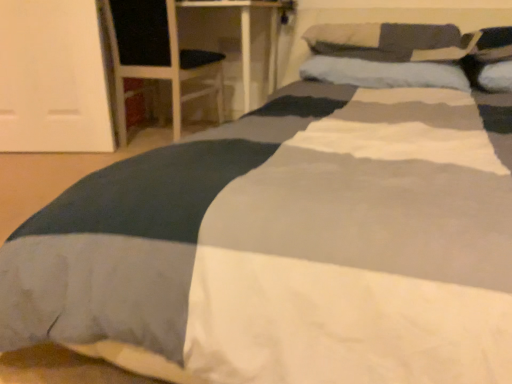
This screenshot has height=384, width=512. What do you see at coordinates (156, 55) in the screenshot?
I see `black fabric armchair at left` at bounding box center [156, 55].

Where is `soft blue pillow at center, which is counted as the second pillow, starting from the top`? soft blue pillow at center, which is counted as the second pillow, starting from the top is located at coordinates (384, 73).

Is point (169, 39) closer or farther from the camera than point (464, 41)?

Point (169, 39).

Which object is closer to the camera taking this photo, black fabric armchair at left or soft gray pillow at upper right, acting as the second pillow starting from the bottom?

Positioned in front is soft gray pillow at upper right, acting as the second pillow starting from the bottom.

Is black fabric armchair at left directly adjacent to soft gray pillow at upper right, which appears as the first pillow when viewed from the top?

No, black fabric armchair at left is not making contact with soft gray pillow at upper right, which appears as the first pillow when viewed from the top.

Is black fabric armchair at left bigger than soft gray pillow at upper right, acting as the second pillow starting from the bottom?

Yes.

Where is `pillow below the soft gray pillow at upper right, acting as the second pillow starting from the bottom (from the image's perspective)`? pillow below the soft gray pillow at upper right, acting as the second pillow starting from the bottom (from the image's perspective) is located at coordinates (384, 73).

Is soft gray pillow at upper right, which appears as the first pillow when viewed from the top, facing away from soft blue pillow at center, which is counted as the second pillow, starting from the top?

soft gray pillow at upper right, which appears as the first pillow when viewed from the top, is not turned away from soft blue pillow at center, which is counted as the second pillow, starting from the top.

Consider the image. From the image's perspective, which object appears higher, soft gray pillow at upper right, which appears as the first pillow when viewed from the top, or soft blue pillow at center, which is the first pillow from bottom to top?

From the image's view, soft gray pillow at upper right, which appears as the first pillow when viewed from the top, is above.

In the scene shown: Which object is further away from the camera, soft gray pillow at upper right, acting as the second pillow starting from the bottom, or soft blue pillow at center, which is counted as the second pillow, starting from the top?

soft blue pillow at center, which is counted as the second pillow, starting from the top.

Measure the distance between soft gray pillow at upper right, which appears as the first pillow when viewed from the top, and black fabric armchair at left.

soft gray pillow at upper right, which appears as the first pillow when viewed from the top, is 32.70 inches away from black fabric armchair at left.

From a real-world perspective, is soft gray pillow at upper right, acting as the second pillow starting from the bottom, physically above black fabric armchair at left?

Yes.

Can you tell me how much soft gray pillow at upper right, which appears as the first pillow when viewed from the top, and black fabric armchair at left differ in facing direction?

There is a 0.632-degree angle between the facing directions of soft gray pillow at upper right, which appears as the first pillow when viewed from the top, and black fabric armchair at left.

Where is `armchair behind the soft gray pillow at upper right, acting as the second pillow starting from the bottom`? armchair behind the soft gray pillow at upper right, acting as the second pillow starting from the bottom is located at coordinates (156, 55).

What are the coordinates of `pillow above the soft blue pillow at center, which is the first pillow from bottom to top (from a real-world perspective)` in the screenshot? It's located at (391, 41).

What's the angular difference between soft blue pillow at center, which is the first pillow from bottom to top, and soft gray pillow at upper right, which appears as the first pillow when viewed from the top,'s facing directions?

soft blue pillow at center, which is the first pillow from bottom to top, and soft gray pillow at upper right, which appears as the first pillow when viewed from the top, are facing 1.19 degrees away from each other.

Is soft blue pillow at center, which is counted as the second pillow, starting from the top, thinner than soft gray pillow at upper right, which appears as the first pillow when viewed from the top?

Correct, the width of soft blue pillow at center, which is counted as the second pillow, starting from the top, is less than that of soft gray pillow at upper right, which appears as the first pillow when viewed from the top.

From the image's perspective, is soft blue pillow at center, which is the first pillow from bottom to top, above soft gray pillow at upper right, acting as the second pillow starting from the bottom?

Actually, soft blue pillow at center, which is the first pillow from bottom to top, appears below soft gray pillow at upper right, acting as the second pillow starting from the bottom, in the image.

Considering the relative positions of soft blue pillow at center, which is counted as the second pillow, starting from the top, and black fabric armchair at left in the image provided, is soft blue pillow at center, which is counted as the second pillow, starting from the top, to the left or to the right of black fabric armchair at left?

soft blue pillow at center, which is counted as the second pillow, starting from the top, is to the right of black fabric armchair at left.

Is soft blue pillow at center, which is the first pillow from bottom to top, positioned in front of black fabric armchair at left?

Yes, the depth of soft blue pillow at center, which is the first pillow from bottom to top, is less than that of black fabric armchair at left.

From the image's perspective, is soft blue pillow at center, which is counted as the second pillow, starting from the top, over black fabric armchair at left?

No.

From a real-world perspective, who is located higher, soft blue pillow at center, which is counted as the second pillow, starting from the top, or black fabric armchair at left?

soft blue pillow at center, which is counted as the second pillow, starting from the top, from a real-world perspective.

Which pillow is the 1st one when counting from the right side of the black fabric armchair at left? Please provide its 2D coordinates.

[(384, 73)]

Between black fabric armchair at left and soft blue pillow at center, which is counted as the second pillow, starting from the top, which one has larger size?

black fabric armchair at left is bigger.

From a real-world perspective, is black fabric armchair at left above or below soft blue pillow at center, which is counted as the second pillow, starting from the top?

In terms of real-world spatial position, black fabric armchair at left is below soft blue pillow at center, which is counted as the second pillow, starting from the top.

The height and width of the screenshot is (384, 512). I want to click on armchair located above the soft gray pillow at upper right, acting as the second pillow starting from the bottom (from the image's perspective), so click(156, 55).

I want to click on pillow that appears behind the soft gray pillow at upper right, acting as the second pillow starting from the bottom, so click(x=384, y=73).

Looking at the image, which one is located closer to soft blue pillow at center, which is the first pillow from bottom to top, black fabric armchair at left or soft gray pillow at upper right, acting as the second pillow starting from the bottom?

Based on the image, soft gray pillow at upper right, acting as the second pillow starting from the bottom, appears to be nearer to soft blue pillow at center, which is the first pillow from bottom to top.

Considering their positions, is black fabric armchair at left positioned further to soft gray pillow at upper right, acting as the second pillow starting from the bottom, than soft blue pillow at center, which is the first pillow from bottom to top?

Based on the image, black fabric armchair at left appears to be further to soft gray pillow at upper right, acting as the second pillow starting from the bottom.

Which object lies further to the anchor point soft gray pillow at upper right, which appears as the first pillow when viewed from the top, soft blue pillow at center, which is counted as the second pillow, starting from the top, or black fabric armchair at left?

Based on the image, black fabric armchair at left appears to be further to soft gray pillow at upper right, which appears as the first pillow when viewed from the top.

From the image, which object appears to be nearer to soft blue pillow at center, which is counted as the second pillow, starting from the top, soft gray pillow at upper right, acting as the second pillow starting from the bottom, or black fabric armchair at left?

Among the two, soft gray pillow at upper right, acting as the second pillow starting from the bottom, is located nearer to soft blue pillow at center, which is counted as the second pillow, starting from the top.

Based on the photo, looking at the image, which one is located further to black fabric armchair at left, soft blue pillow at center, which is counted as the second pillow, starting from the top, or soft gray pillow at upper right, acting as the second pillow starting from the bottom?

Among the two, soft gray pillow at upper right, acting as the second pillow starting from the bottom, is located further to black fabric armchair at left.

When comparing their distances from black fabric armchair at left, does soft gray pillow at upper right, acting as the second pillow starting from the bottom, or soft blue pillow at center, which is counted as the second pillow, starting from the top, seem closer?

The object closer to black fabric armchair at left is soft blue pillow at center, which is counted as the second pillow, starting from the top.

You are a GUI agent. You are given a task and a screenshot of the screen. Output one action in this format:
    pyautogui.click(x=<x>, y=<y>)
    Task: Click on the pillow situated between black fabric armchair at left and soft gray pillow at upper right, acting as the second pillow starting from the bottom, from left to right
    This screenshot has width=512, height=384.
    Given the screenshot: What is the action you would take?
    pyautogui.click(x=384, y=73)